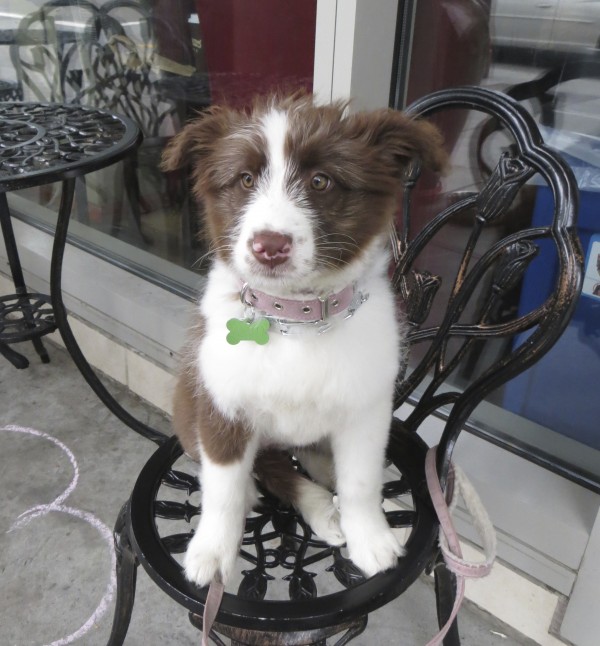
Image resolution: width=600 pixels, height=646 pixels. In order to click on chair in this screenshot , I will do `click(453, 371)`.